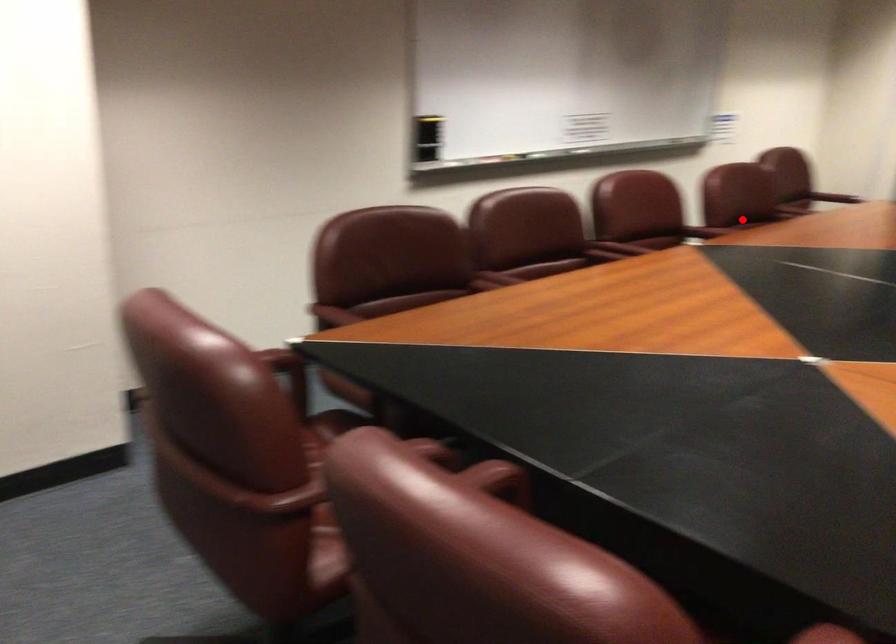
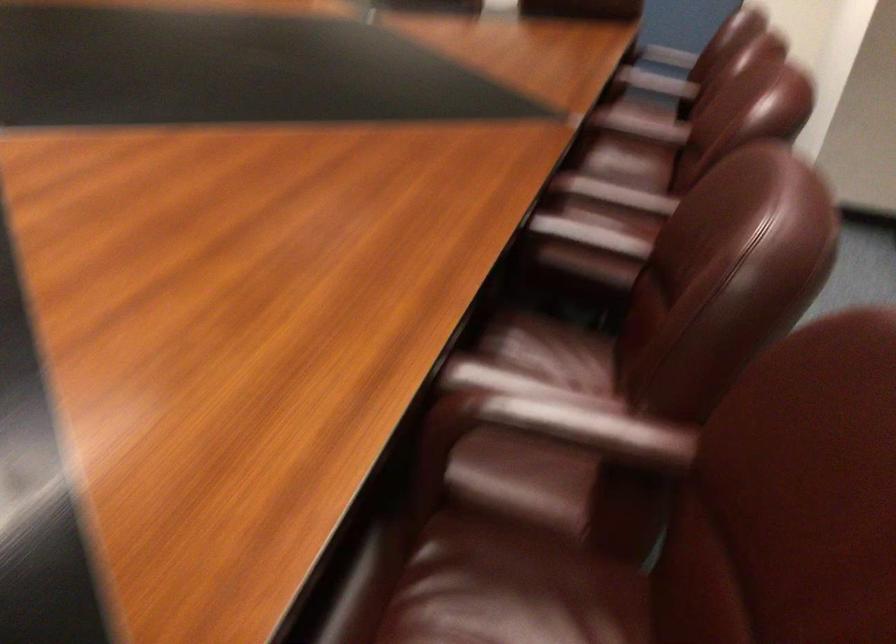
Question: I am providing you with two images of the same scene from different viewpoints. Given a red point in image1, look at the same physical point in image2. Is it:

Choices:
 (A) Closer to the viewpoint
 (B) Farther from the viewpoint

Answer: (A)